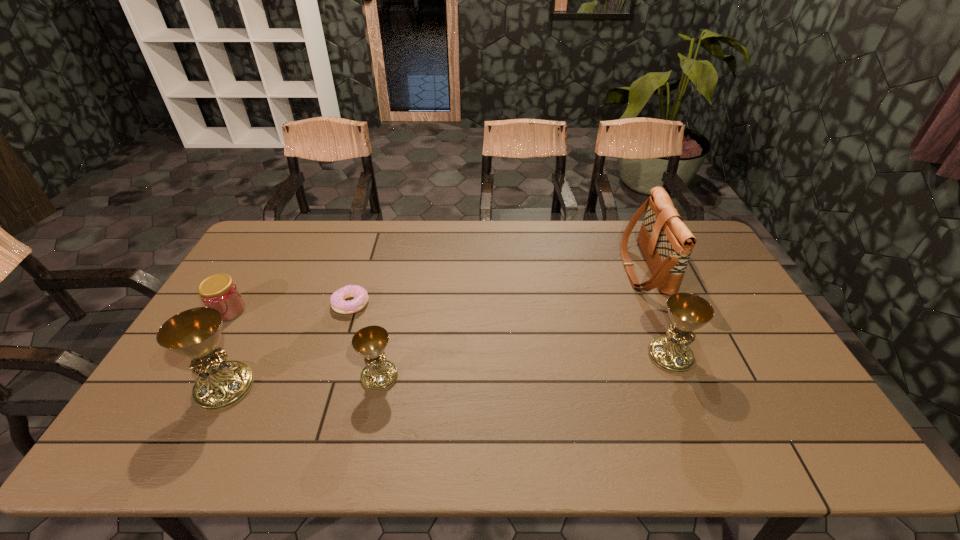
This screenshot has width=960, height=540. What are the coordinates of `free space located 0.310m on the left of the fourth tallest object` in the screenshot? It's located at (244, 376).

In order to click on vacant region located on the front of the rightmost chalice in this screenshot , I will do `click(687, 396)`.

Find the location of a particular element. This screenshot has height=540, width=960. free space located on the front-facing side of the shoulder bag is located at coordinates (529, 267).

At what (x,y) coordinates should I click in order to perform the action: click on vacant space located 0.180m on the front-facing side of the shoulder bag. Please return your answer as a coordinate pair (x, y). Image resolution: width=960 pixels, height=540 pixels. Looking at the image, I should click on (570, 267).

Locate an element on the screen. The image size is (960, 540). free spot located 0.280m on the front-facing side of the shoulder bag is located at coordinates (540, 267).

This screenshot has height=540, width=960. I want to click on blank space located on the back of the fifth tallest object, so click(256, 265).

Identify the location of vacant space located on the back of the fourth object from right to left. This screenshot has width=960, height=540. (368, 250).

Where is `object at the far edge`? object at the far edge is located at coordinates (666, 242).

The width and height of the screenshot is (960, 540). I want to click on chalice that is at the left edge, so click(x=195, y=333).

The height and width of the screenshot is (540, 960). In order to click on jam located at the left edge in this screenshot , I will do `click(219, 291)`.